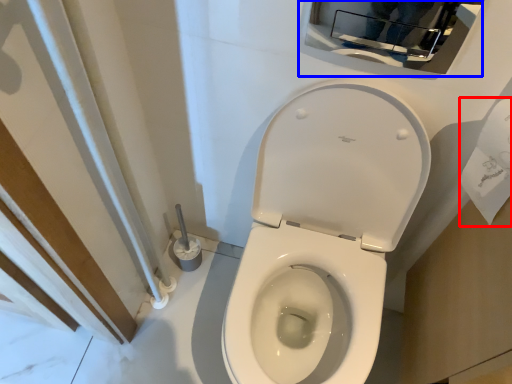
Question: Which object appears closest to the camera in this image, toilet paper (highlighted by a red box) or medicine cabinet (highlighted by a blue box)?

Choices:
 (A) toilet paper
 (B) medicine cabinet

Answer: (A)